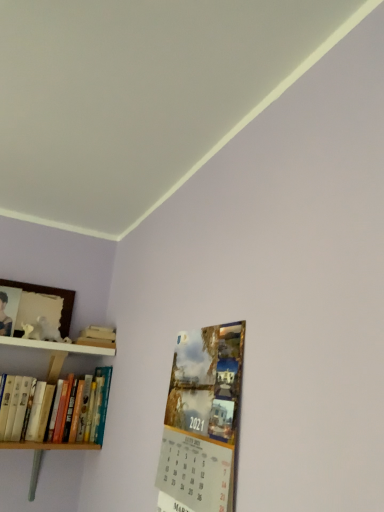
Question: Does hardcover books at left have a larger size compared to wooden shelf at upper left?

Choices:
 (A) yes
 (B) no

Answer: (A)

Question: Does hardcover books at left contain wooden shelf at upper left?

Choices:
 (A) yes
 (B) no

Answer: (B)

Question: From a real-world perspective, is hardcover books at left on wooden shelf at upper left?

Choices:
 (A) no
 (B) yes

Answer: (A)

Question: From the image's perspective, would you say hardcover books at left is shown under wooden shelf at upper left?

Choices:
 (A) yes
 (B) no

Answer: (A)

Question: From a real-world perspective, does hardcover books at left sit lower than wooden shelf at upper left?

Choices:
 (A) no
 (B) yes

Answer: (B)

Question: Does hardcover books at left appear on the left side of wooden shelf at upper left?

Choices:
 (A) no
 (B) yes

Answer: (A)

Question: Is hardcover books at left wider than matte paper calendar at lower right?

Choices:
 (A) no
 (B) yes

Answer: (B)

Question: Is hardcover books at left far away from matte paper calendar at lower right?

Choices:
 (A) no
 (B) yes

Answer: (A)

Question: Is hardcover books at left turned away from matte paper calendar at lower right?

Choices:
 (A) yes
 (B) no

Answer: (B)

Question: Is hardcover books at left bigger than matte paper calendar at lower right?

Choices:
 (A) yes
 (B) no

Answer: (A)

Question: Does hardcover books at left have a greater height compared to matte paper calendar at lower right?

Choices:
 (A) yes
 (B) no

Answer: (B)

Question: Can you confirm if hardcover books at left is shorter than matte paper calendar at lower right?

Choices:
 (A) yes
 (B) no

Answer: (A)

Question: Is matte paper calendar at lower right beside hardcover books at left?

Choices:
 (A) no
 (B) yes

Answer: (A)